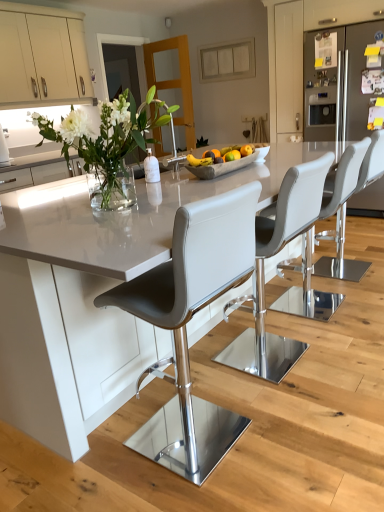
At what (x,y) coordinates should I click in order to perform the action: click on vacant space in front of gray leather stool at center, arranged as the 3th chair when viewed from the front. Please return your answer as a coordinate pair (x, y). The width and height of the screenshot is (384, 512). Looking at the image, I should click on (332, 334).